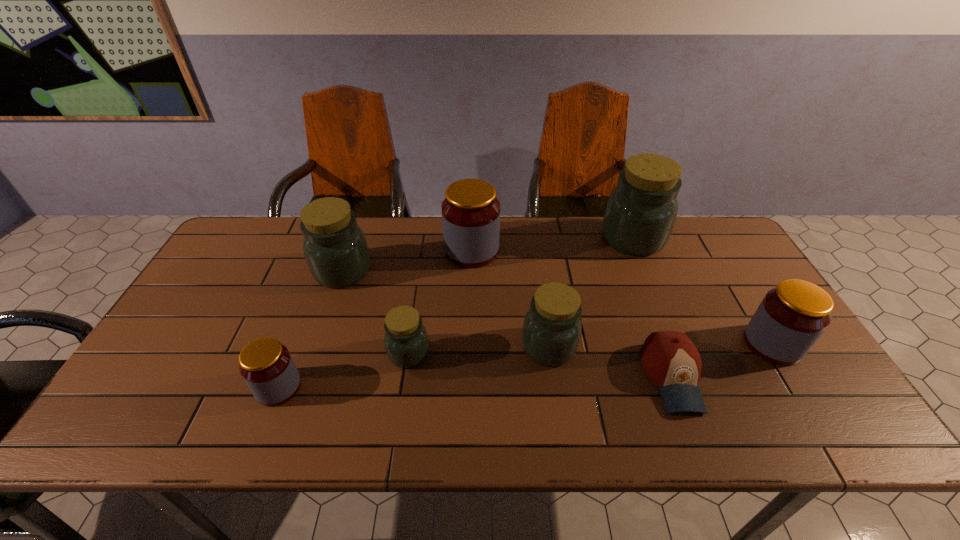
I want to click on the leftmost red jar, so click(x=265, y=364).

You are a GUI agent. You are given a task and a screenshot of the screen. Output one action in this format:
    pyautogui.click(x=<x>, y=<y>)
    Task: Click on the sixth object from right to left
    This screenshot has width=960, height=540.
    Given the screenshot: What is the action you would take?
    pyautogui.click(x=406, y=341)

At what (x,y) coordinates should I click in order to perform the action: click on the second green jar from left to right. Please return your answer as a coordinate pair (x, y). Looking at the image, I should click on (406, 341).

The height and width of the screenshot is (540, 960). What are the coordinates of `baseball cap` in the screenshot? It's located at (670, 359).

Identify the location of red baseball cap. (670, 359).

Locate an element on the screen. Image resolution: width=960 pixels, height=540 pixels. free space located 0.160m on the left of the biggest green jar is located at coordinates (552, 239).

Find the location of a particular element. The image size is (960, 540). vacant space situated 0.360m on the left of the farthest red jar is located at coordinates (332, 251).

The width and height of the screenshot is (960, 540). I want to click on free spot located 0.370m on the right of the leftmost green jar, so click(x=492, y=271).

You are a GUI agent. You are given a task and a screenshot of the screen. Output one action in this format:
    pyautogui.click(x=<x>, y=<y>)
    Task: Click on the blank space located 0.370m on the right of the third biggest green jar
    This screenshot has height=540, width=960.
    Given the screenshot: What is the action you would take?
    pyautogui.click(x=720, y=347)

You are a GUI agent. You are given a task and a screenshot of the screen. Output one action in this format:
    pyautogui.click(x=<x>, y=<y>)
    Task: Click on the vacant space situated 0.160m on the left of the rightmost jar
    The height and width of the screenshot is (540, 960).
    Given the screenshot: What is the action you would take?
    pos(684,344)